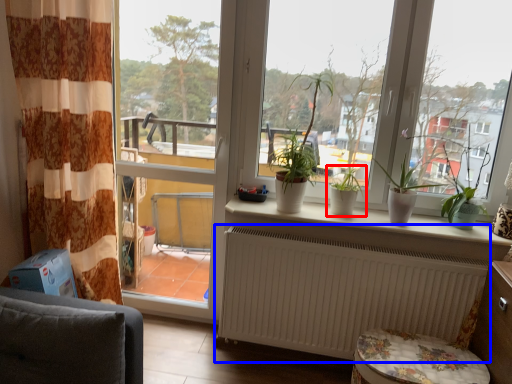
Question: Which point is closer to the camera, houseplant (highlighted by a red box) or radiator (highlighted by a blue box)?

Choices:
 (A) houseplant
 (B) radiator

Answer: (B)